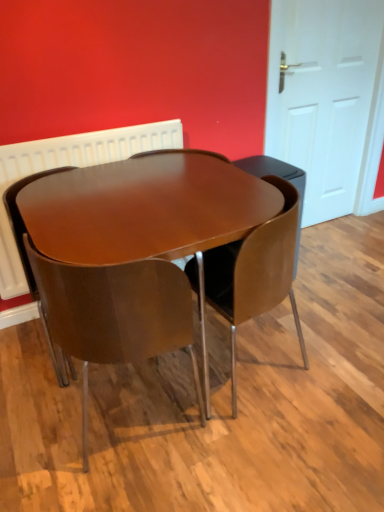
Locate an element on the screen. The height and width of the screenshot is (512, 384). vacant space to the right of matte brown chair at center, acting as the 2th chair starting from the left is located at coordinates point(256,444).